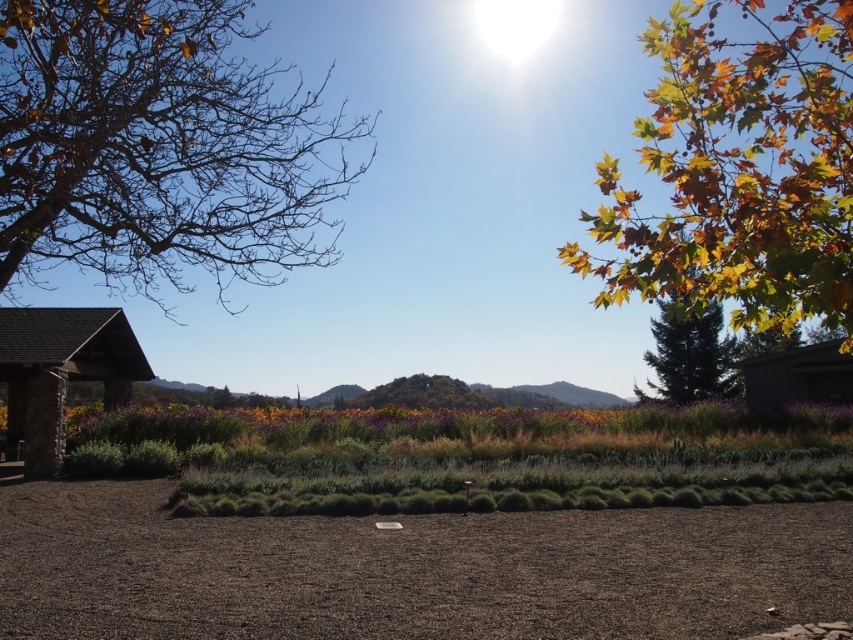
Question: In this image, where is stone/wooden hut at left located relative to dark brown wood hut at right?

Choices:
 (A) left
 (B) right

Answer: (A)

Question: Which of the following is the farthest from the observer?

Choices:
 (A) (773, 371)
 (B) (54, 193)
 (C) (607, 157)

Answer: (A)

Question: Among these points, which one is farthest from the camera?

Choices:
 (A) (740, 61)
 (B) (112, 355)
 (C) (764, 355)
 (D) (708, 305)

Answer: (C)

Question: Can you confirm if bare branches at upper left is smaller than green matte tree at right?

Choices:
 (A) yes
 (B) no

Answer: (B)

Question: Considering the real-world distances, which object is closest to the green matte tree at right?

Choices:
 (A) dark brown gravel at lower center
 (B) dark brown wood hut at right
 (C) golden leafy tree at upper right

Answer: (B)

Question: Is golden leafy tree at upper right further to camera compared to stone/wooden hut at left?

Choices:
 (A) yes
 (B) no

Answer: (B)